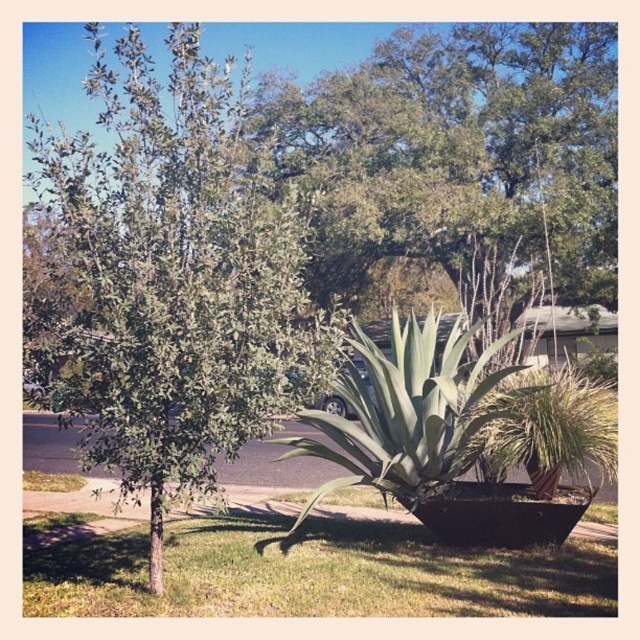
Question: Does green grass at lower center have a larger size compared to green leafy plant at center?

Choices:
 (A) no
 (B) yes

Answer: (A)

Question: Does green leafy tree at left appear on the left side of green leafy tree at upper left?

Choices:
 (A) no
 (B) yes

Answer: (B)

Question: Which of the following is the closest to the observer?

Choices:
 (A) 166,266
 (B) 102,612
 (C) 516,388
 (D) 486,84

Answer: (A)

Question: Which of these objects is positioned closest to the green leafy tree at upper left?

Choices:
 (A) green grass at lower center
 (B) green leafy plant at center

Answer: (B)

Question: Which point is farther to the camera?

Choices:
 (A) green leafy plant at center
 (B) green grass at lower center
 (C) green leafy tree at upper left
 (D) green leafy tree at left

Answer: (C)

Question: Is green leafy tree at left to the left of green leafy tree at upper left from the viewer's perspective?

Choices:
 (A) yes
 (B) no

Answer: (A)